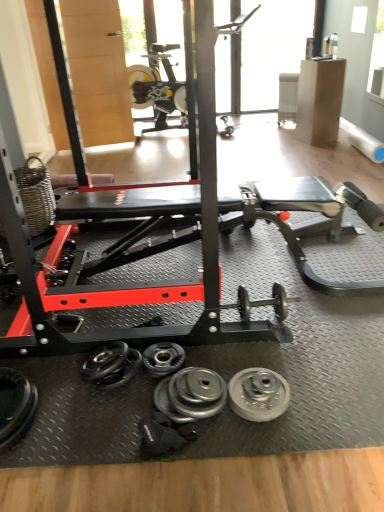
Identify the location of free location to the right of silver metallic dumbbell at center, the second dumbbell when ordered from left to right. (210, 354).